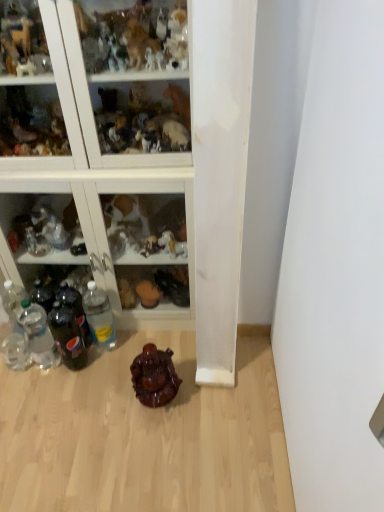
Identify the location of empty space that is to the right of black plastic bottles at left, which is the 3th bottle from right to left. This screenshot has height=512, width=384. (124, 335).